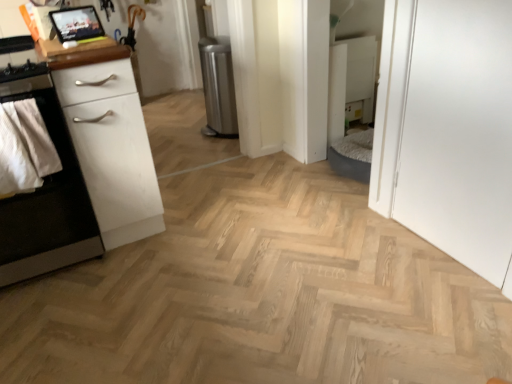
Question: Looking at the image, does natural wood floor at center seem bigger or smaller compared to matte black tablet at upper left, the 1th appliance positioned from the left?

Choices:
 (A) small
 (B) big

Answer: (B)

Question: From a real-world perspective, is natural wood floor at center positioned above or below matte black tablet at upper left, arranged as the 2th appliance when viewed from the back?

Choices:
 (A) above
 (B) below

Answer: (B)

Question: Which object is positioned closest to the white matte cabinet at left?

Choices:
 (A) matte wood tablet at upper left
 (B) white matte chest of drawers at left
 (C) metallic trash can at center, the first appliance viewed from the right
 (D) matte black tablet at upper left, which is counted as the 2th appliance, starting from the right
 (E) natural wood floor at center

Answer: (B)

Question: Estimate the real-world distances between objects in this image. Which object is closer to the metallic trash can at center, the first appliance viewed from the right?

Choices:
 (A) white cotton towel at left
 (B) white matte chest of drawers at left
 (C) white matte cabinet at left
 (D) natural wood floor at center
 (E) matte wood tablet at upper left

Answer: (B)